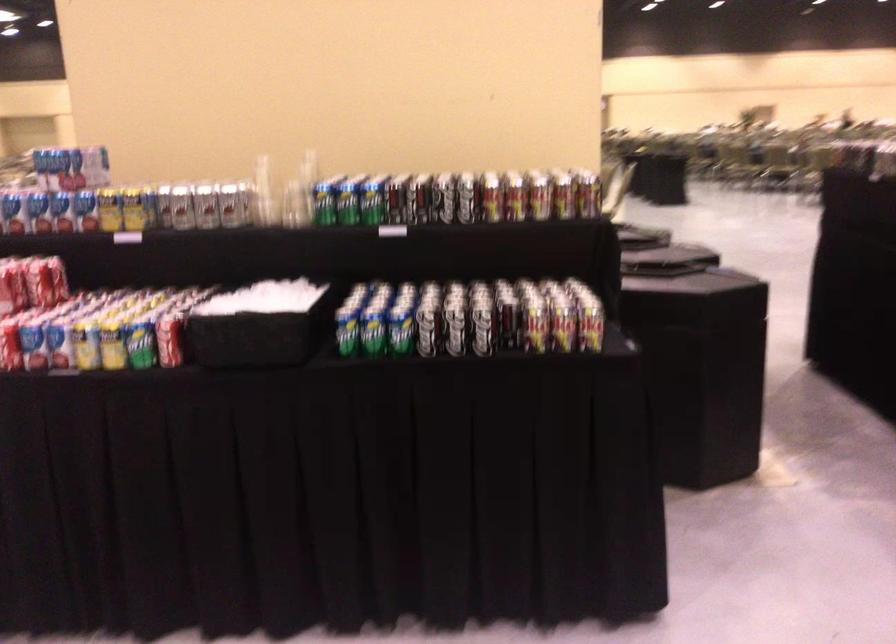
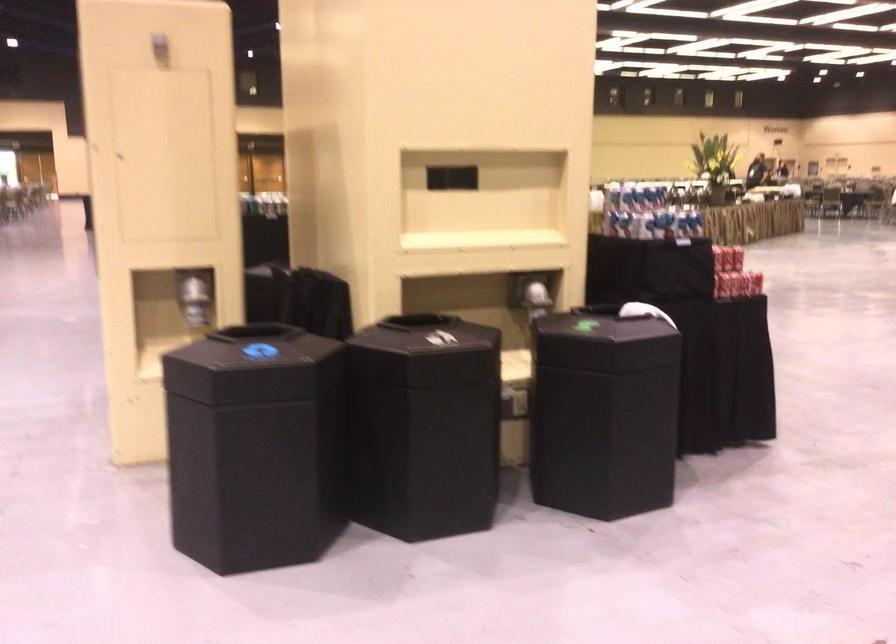
Question: I am providing you with two images of the same scene from different viewpoints. Please identify which objects are invisible in image2.

Choices:
 (A) black bin lid
 (B) yellow soda can
 (C) shiny dispenser lever
 (D) black keyboard

Answer: (B)